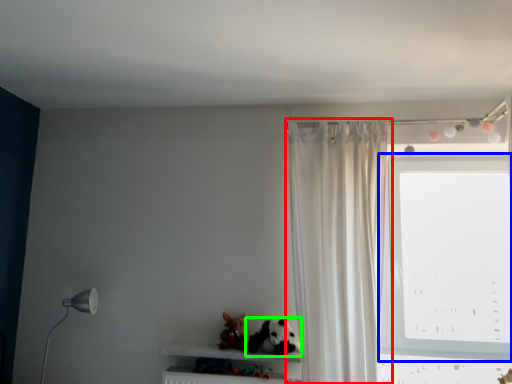
Question: Which object is the farthest from curtain (highlighted by a red box)? Choose among these: window (highlighted by a blue box) or animal (highlighted by a green box).

Choices:
 (A) window
 (B) animal

Answer: (A)